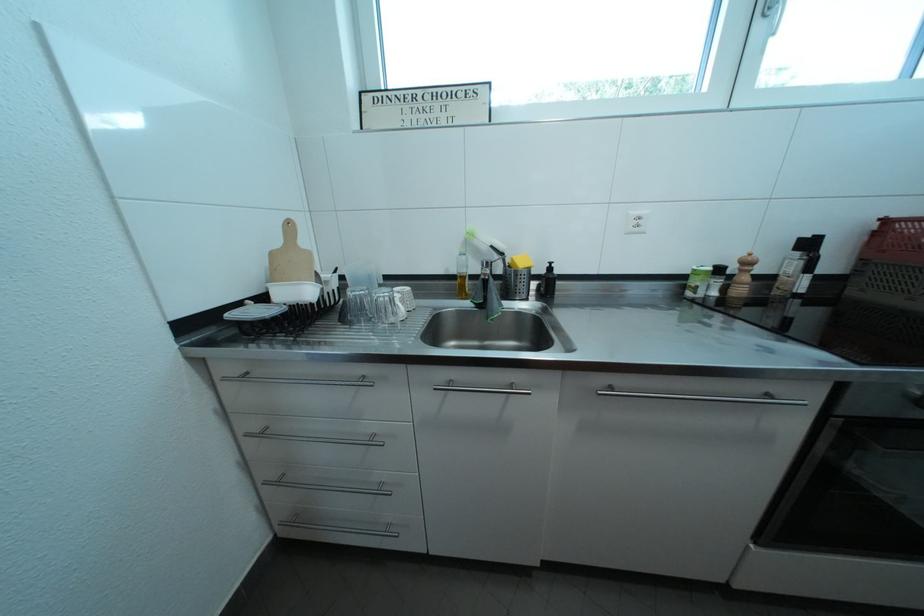
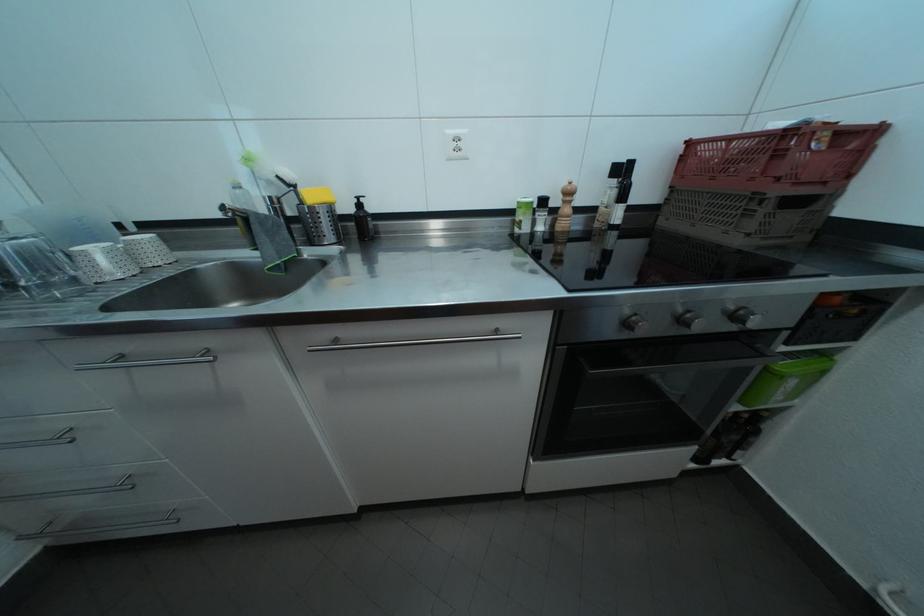
In the second image, find the point that corresponds to [410,307] in the first image.

(137, 259)